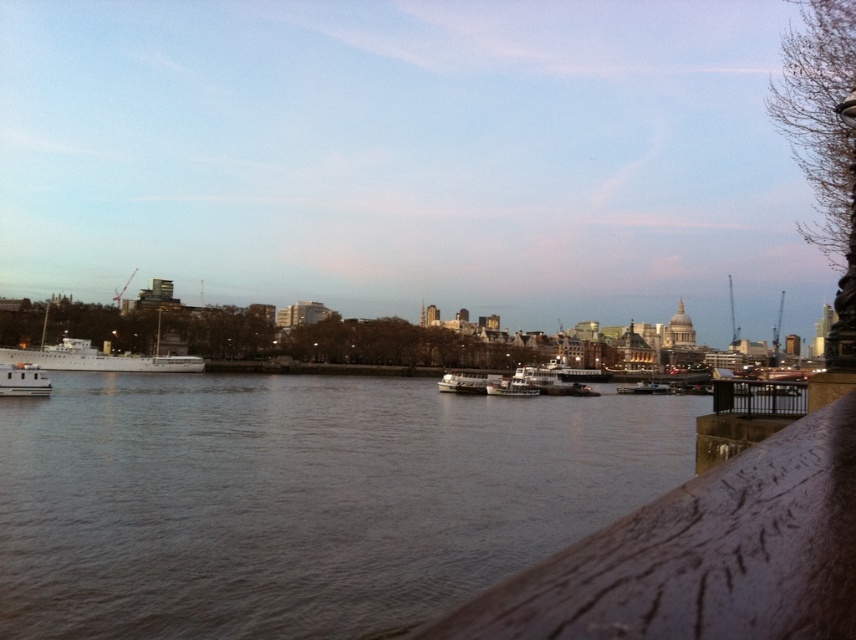
You are a painter setting up your easel to capture the riverside scene. You want to ensure that the brown wooden rail at lower right and the white matte ship at left are both visible in your painting. Given their widths, which object should you place closer to the edge of your canvas to maintain their proportions?

The brown wooden rail at lower right has a smaller width compared to the white matte ship at left. To maintain their proportions, you should place the brown wooden rail at lower right closer to the edge of your canvas since it is narrower and requires less space to be accurately represented.

You are standing on the riverside path and want to take a photo of the metallic silver boat at center without any obstructions. Is the brown wooden rail at lower right blocking your view of the boat?

The brown wooden rail at lower right is much taller than the metallic silver boat at center, so it might block your view of the boat.